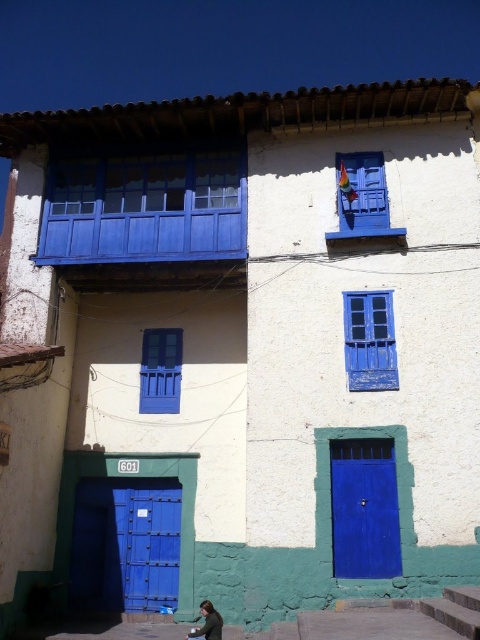
Does blue painted wood window at center appear on the right side of matte blue window at center?

Yes, blue painted wood window at center is to the right of matte blue window at center.

Who is higher up, blue painted wood window at center or matte blue window at center?

Positioned higher is blue painted wood window at center.

Identify the location of blue painted wood window at center. This screenshot has height=640, width=480. (370, 340).

Locate an element on the screen. blue painted wood window at center is located at coordinates (370, 340).

Is blue matte door at lower center to the right of blue painted wood window at center from the viewer's perspective?

No, blue matte door at lower center is not to the right of blue painted wood window at center.

Is blue matte door at lower center shorter than blue painted wood window at center?

In fact, blue matte door at lower center may be taller than blue painted wood window at center.

Does point (333, 449) lie in front of point (376, 372)?

Yes, point (333, 449) is closer to viewer.

At what (x,y) coordinates should I click in order to perform the action: click on blue matte door at lower center. Please return your answer as a coordinate pair (x, y). The width and height of the screenshot is (480, 640). Looking at the image, I should click on (x=364, y=508).

Who is positioned more to the right, blue painted wood window at upper center or matte green dress at lower center?

From the viewer's perspective, blue painted wood window at upper center appears more on the right side.

Between point (354, 212) and point (201, 628), which one is positioned in front?

Point (201, 628)

Measure the distance between point (348,173) and camera.

Point (348,173) is 13.37 meters away from camera.

This screenshot has width=480, height=640. I want to click on blue painted wood window at upper center, so click(x=360, y=192).